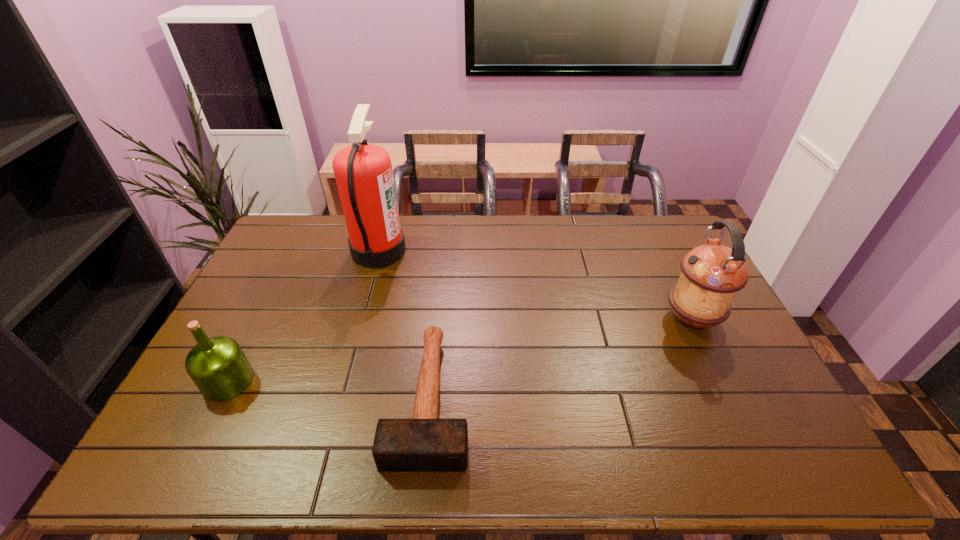
Identify the location of the tallest object. (363, 172).

You are a GUI agent. You are given a task and a screenshot of the screen. Output one action in this format:
    pyautogui.click(x=<x>, y=<y>)
    Task: Click on the second object from left to right
    
    Given the screenshot: What is the action you would take?
    pyautogui.click(x=363, y=172)

At what (x,y) coordinates should I click in order to perform the action: click on the rightmost object. Please return your answer as a coordinate pair (x, y). Image resolution: width=960 pixels, height=540 pixels. Looking at the image, I should click on (711, 275).

The height and width of the screenshot is (540, 960). I want to click on oil lamp, so click(x=711, y=275).

Where is `olive oil`? The image size is (960, 540). olive oil is located at coordinates (218, 366).

Identify the location of the leftmost object. (218, 366).

I want to click on mallet, so [423, 444].

You are a GUI agent. You are given a task and a screenshot of the screen. Output one action in this format:
    pyautogui.click(x=<x>, y=<y>)
    Task: Click on the shortest object
    This screenshot has width=960, height=540.
    Given the screenshot: What is the action you would take?
    pyautogui.click(x=423, y=444)

Locate an element on the screen. This screenshot has width=960, height=540. vacant space situated at the nozzle of the tallest object is located at coordinates (460, 251).

In order to click on vacant space positioned 0.350m on the front of the rightmost object in this screenshot , I will do (x=757, y=456).